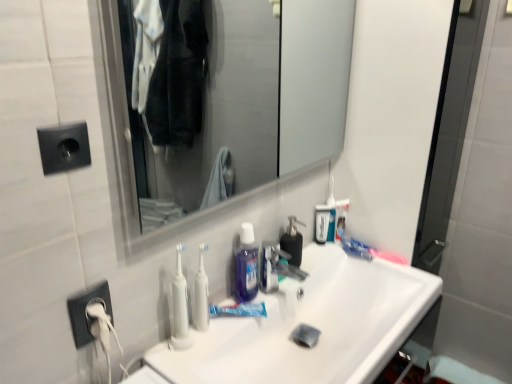
Locate an element on the screen. The image size is (512, 384). free space between black matte soap dispenser at center and pink plastic toothbrush at upper right, arranged as the first toothbrush when viewed from the back is located at coordinates (346, 264).